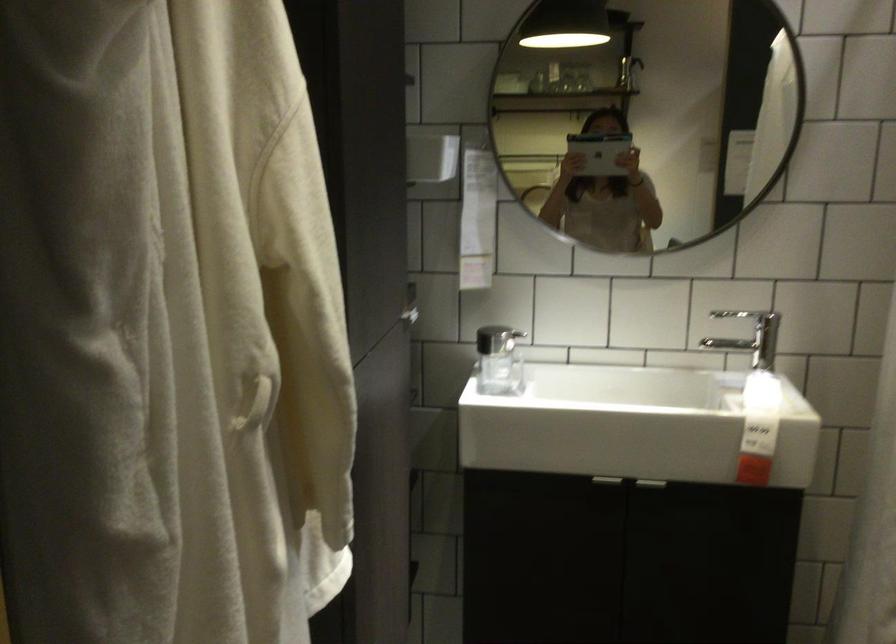
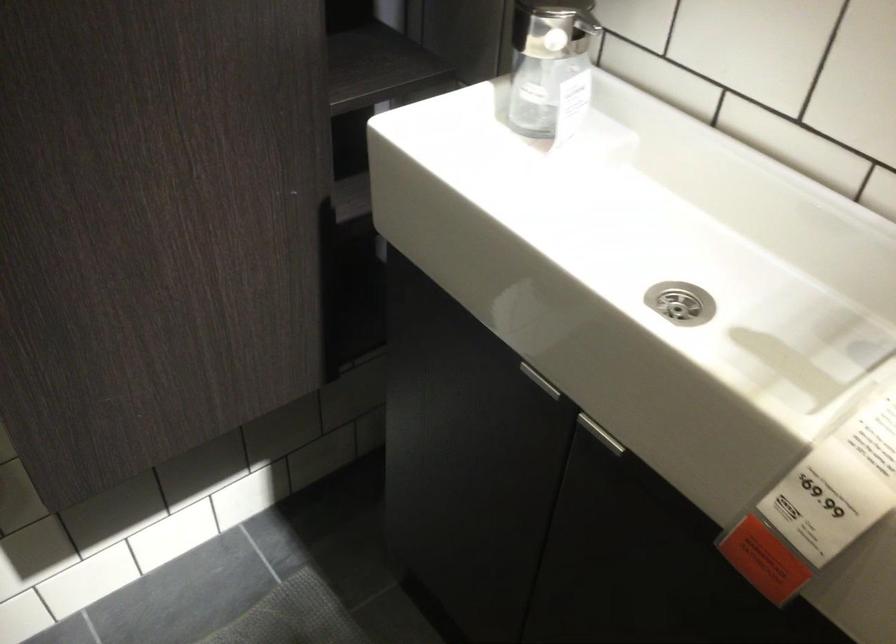
Where in the second image is the point corresponding to pixel 513 342 from the first image?

(547, 35)